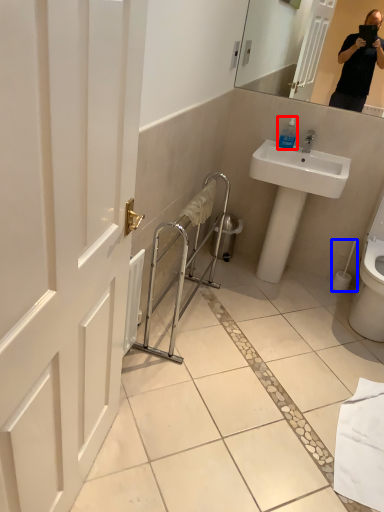
Question: Which of the following is the closest to the observer, soap dispenser (highlighted by a red box) or toilet paper (highlighted by a blue box)?

Choices:
 (A) soap dispenser
 (B) toilet paper

Answer: (A)